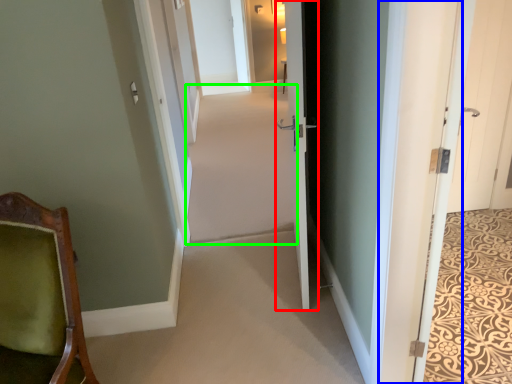
Question: Based on their relative distances, which object is nearer to door (highlighted by a red box)? Choose from door (highlighted by a blue box) and plain (highlighted by a green box).

Choices:
 (A) door
 (B) plain

Answer: (A)